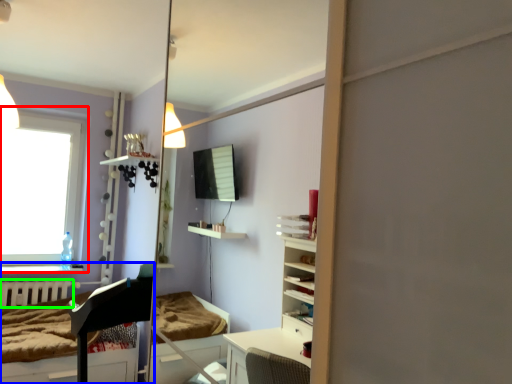
Question: Estimate the real-world distances between objects in this image. Which object is closer to window (highlighted by a red box), furniture (highlighted by a blue box) or radiator (highlighted by a green box)?

Choices:
 (A) furniture
 (B) radiator

Answer: (B)